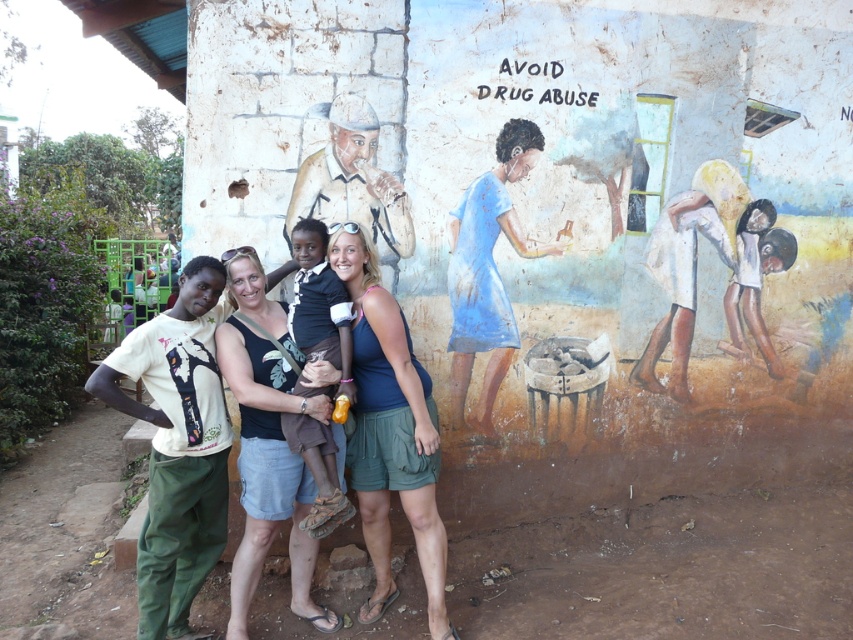
You are standing in front of the mural and notice the blue fabric tank top at center. Can you determine its exact position using the coordinate system provided?

The blue fabric tank top at center is located at point (390, 433) in the coordinate system.

Consider the image. You are a photographer who needs to adjust the lighting to highlight the blue fabric tank top at center. Which part of the scene should you focus on to ensure the tank top is well lit?

The blue fabric tank top at center is located at point [390,433], so you should focus the lighting on that coordinate to ensure it is well lit.